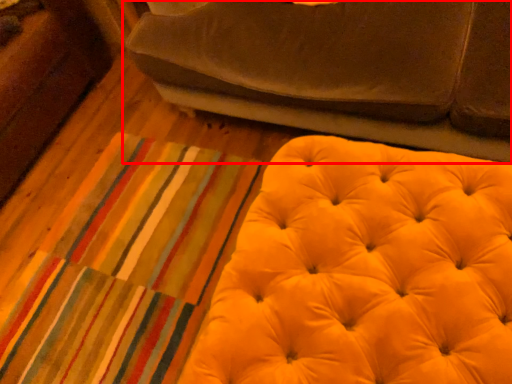
Question: From the image's perspective, where is studio couch (annotated by the red box) located in relation to furniture in the image?

Choices:
 (A) below
 (B) above

Answer: (B)